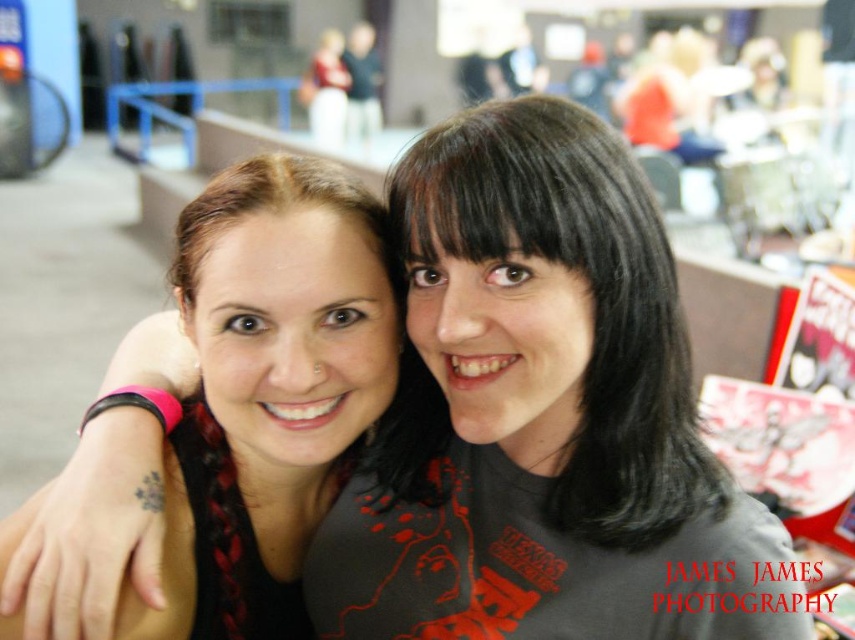
You are a photographer trying to frame a portrait of the two people in the image. You need to ensure that the black matte hair at center and the matte black shirt at center are both clearly visible. Based on their widths, which object should you focus on first to ensure proper exposure?

The black matte hair at center has a greater width than the matte black shirt at center. Therefore, you should focus on the black matte hair at center first to ensure proper exposure, as it occupies more space in the frame.